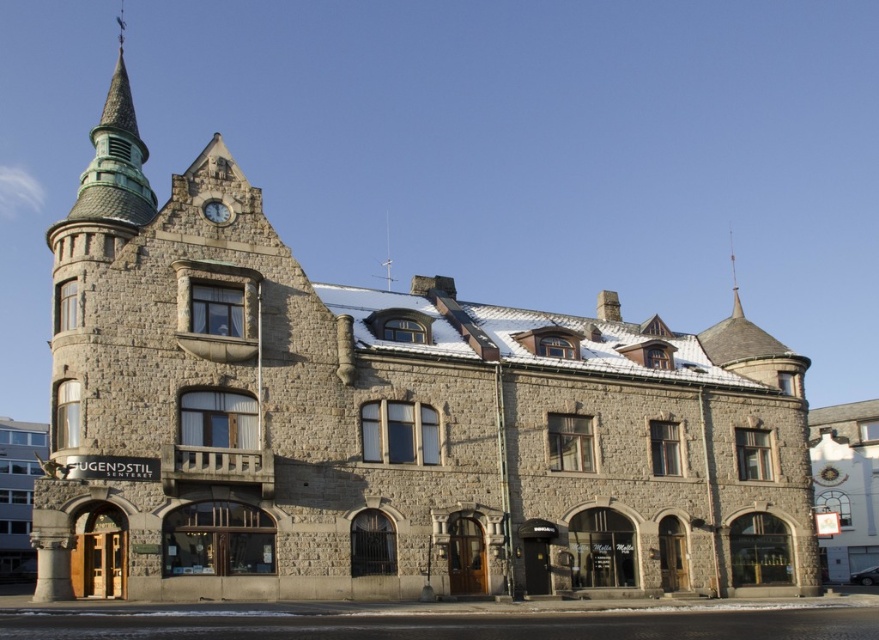
Question: Can you confirm if green copper spire at upper left is wider than matte gray clock at upper center?

Choices:
 (A) yes
 (B) no

Answer: (A)

Question: Based on their relative distances, which object is farther from the shiny metallic spire at upper center?

Choices:
 (A) stone building at left
 (B) matte gray clock at upper center
 (C) green copper spire at upper left

Answer: (C)

Question: Which is farther from the shiny metallic spire at upper center?

Choices:
 (A) matte gray clock at upper center
 (B) green copper spire at upper left
 (C) stone building at left

Answer: (B)

Question: Which point is farther from the camera taking this photo?

Choices:
 (A) (734, 264)
 (B) (218, 200)
 (C) (0, 449)
 (D) (143, 192)

Answer: (A)

Question: Can you confirm if stone building at left is positioned above shiny metallic spire at upper center?

Choices:
 (A) no
 (B) yes

Answer: (A)

Question: Can you confirm if green copper spire at upper left is positioned above shiny metallic spire at upper center?

Choices:
 (A) yes
 (B) no

Answer: (A)